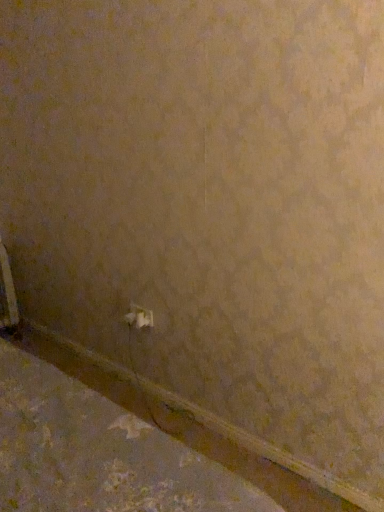
Question: Is brown matte concrete at lower left taller than white plastic power plug at center?

Choices:
 (A) yes
 (B) no

Answer: (B)

Question: Is brown matte concrete at lower left closer to the viewer compared to white plastic power plug at center?

Choices:
 (A) no
 (B) yes

Answer: (B)

Question: Is white plastic power plug at center at the back of brown matte concrete at lower left?

Choices:
 (A) no
 (B) yes

Answer: (A)

Question: Is brown matte concrete at lower left further to the viewer compared to white plastic power plug at center?

Choices:
 (A) no
 (B) yes

Answer: (A)

Question: Is brown matte concrete at lower left shorter than white plastic power plug at center?

Choices:
 (A) yes
 (B) no

Answer: (A)

Question: Is point (8, 267) closer or farther from the camera than point (112, 435)?

Choices:
 (A) closer
 (B) farther

Answer: (B)

Question: Would you say white plastic radiator at lower left is to the left or to the right of brown matte concrete at lower left in the picture?

Choices:
 (A) left
 (B) right

Answer: (A)

Question: Is white plastic radiator at lower left taller or shorter than brown matte concrete at lower left?

Choices:
 (A) short
 (B) tall

Answer: (B)

Question: Would you say white plastic radiator at lower left is inside or outside brown matte concrete at lower left?

Choices:
 (A) outside
 (B) inside

Answer: (A)

Question: Would you say brown matte concrete at lower left is to the left or to the right of white plastic power plug at center in the picture?

Choices:
 (A) left
 (B) right

Answer: (B)

Question: From the image's perspective, is brown matte concrete at lower left above or below white plastic power plug at center?

Choices:
 (A) above
 (B) below

Answer: (B)

Question: Considering the positions of point pyautogui.click(x=150, y=454) and point pyautogui.click(x=140, y=309), is point pyautogui.click(x=150, y=454) closer or farther from the camera than point pyautogui.click(x=140, y=309)?

Choices:
 (A) farther
 (B) closer

Answer: (B)

Question: Considering the positions of brown matte concrete at lower left and white plastic power plug at center in the image, is brown matte concrete at lower left wider or thinner than white plastic power plug at center?

Choices:
 (A) thin
 (B) wide

Answer: (B)

Question: Considering the positions of white plastic radiator at lower left and white plastic power plug at center in the image, is white plastic radiator at lower left taller or shorter than white plastic power plug at center?

Choices:
 (A) tall
 (B) short

Answer: (A)

Question: Is white plastic radiator at lower left inside or outside of white plastic power plug at center?

Choices:
 (A) inside
 (B) outside

Answer: (B)